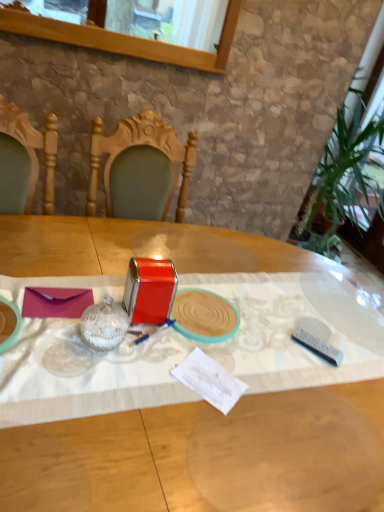
Question: Does white plastic remote at lower right, the first tableware when ordered from right to left, have a greater height compared to clear glass window at upper center?

Choices:
 (A) yes
 (B) no

Answer: (B)

Question: Is white plastic remote at lower right, acting as the 4th tableware starting from the left, oriented away from clear glass window at upper center?

Choices:
 (A) no
 (B) yes

Answer: (A)

Question: Does white plastic remote at lower right, the first tableware when ordered from right to left, appear on the left side of clear glass window at upper center?

Choices:
 (A) yes
 (B) no

Answer: (B)

Question: Is clear glass window at upper center completely or partially inside white plastic remote at lower right, acting as the 4th tableware starting from the left?

Choices:
 (A) no
 (B) yes

Answer: (A)

Question: Considering the relative sizes of white plastic remote at lower right, the first tableware when ordered from right to left, and clear glass window at upper center in the image provided, is white plastic remote at lower right, the first tableware when ordered from right to left, shorter than clear glass window at upper center?

Choices:
 (A) no
 (B) yes

Answer: (B)

Question: Is clear glass window at upper center inside the boundaries of metallic red tin at center, or outside?

Choices:
 (A) outside
 (B) inside

Answer: (A)

Question: In terms of width, does clear glass window at upper center look wider or thinner when compared to metallic red tin at center?

Choices:
 (A) wide
 (B) thin

Answer: (B)

Question: Considering the positions of clear glass window at upper center and metallic red tin at center in the image, is clear glass window at upper center bigger or smaller than metallic red tin at center?

Choices:
 (A) small
 (B) big

Answer: (A)

Question: Considering the relative positions of clear glass window at upper center and metallic red tin at center in the image provided, is clear glass window at upper center to the left or to the right of metallic red tin at center?

Choices:
 (A) left
 (B) right

Answer: (A)

Question: From the image's perspective, is white plastic remote at lower right, acting as the 4th tableware starting from the left, located above or below purple matte envelope at center?

Choices:
 (A) below
 (B) above

Answer: (A)

Question: Is white plastic remote at lower right, acting as the 4th tableware starting from the left, wider or thinner than purple matte envelope at center?

Choices:
 (A) wide
 (B) thin

Answer: (B)

Question: From a real-world perspective, is white plastic remote at lower right, the first tableware when ordered from right to left, positioned above or below purple matte envelope at center?

Choices:
 (A) above
 (B) below

Answer: (A)

Question: Visually, is white plastic remote at lower right, the first tableware when ordered from right to left, positioned to the left or to the right of purple matte envelope at center?

Choices:
 (A) right
 (B) left

Answer: (A)

Question: Visually, is metallic red tin at center, positioned as the second tableware in left-to-right order, positioned to the left or to the right of metallic red tin at center, marked as the third tableware in a left-to-right arrangement?

Choices:
 (A) left
 (B) right

Answer: (A)

Question: Considering the positions of metallic red tin at center, the third tableware from the right, and metallic red tin at center, marked as the 2th tableware in a right-to-left arrangement, in the image, is metallic red tin at center, the third tableware from the right, bigger or smaller than metallic red tin at center, marked as the 2th tableware in a right-to-left arrangement,?

Choices:
 (A) big
 (B) small

Answer: (A)